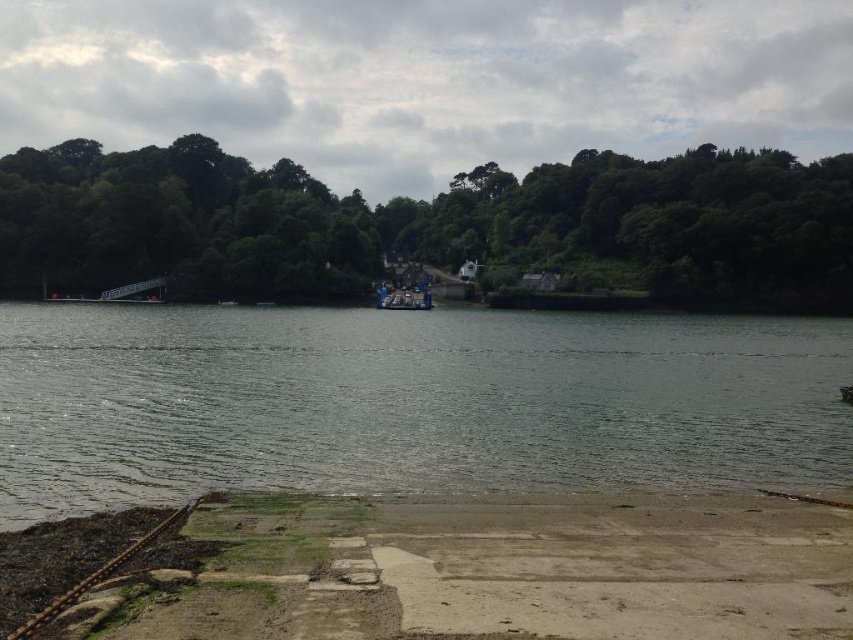
Can you confirm if concrete at lower center is positioned above blue metallic boat at center?

No.

Does concrete at lower center lie in front of blue metallic boat at center?

Yes, it is in front of blue metallic boat at center.

Does point (524, 547) come closer to viewer compared to point (431, 301)?

Yes, point (524, 547) is closer to viewer.

Identify the location of concrete at lower center. The width and height of the screenshot is (853, 640). (436, 570).

Locate an element on the screen. concrete at lower center is located at coordinates (436, 570).

In order to click on concrete at lower center in this screenshot , I will do `click(436, 570)`.

Who is lower down, green leafy trees at upper center or blue metallic boat at center?

Positioned lower is blue metallic boat at center.

Between green leafy trees at upper center and blue metallic boat at center, which one appears on the right side from the viewer's perspective?

blue metallic boat at center is more to the right.

Between point (834, 204) and point (425, 305), which one is positioned behind?

Positioned behind is point (834, 204).

The width and height of the screenshot is (853, 640). Find the location of `green leafy trees at upper center`. green leafy trees at upper center is located at coordinates (428, 224).